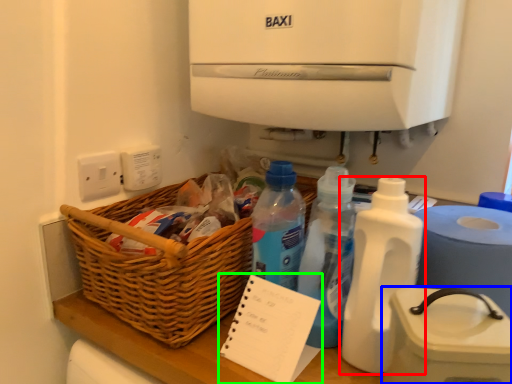
Question: Estimate the real-world distances between objects in this image. Which object is closer to bottle (highlighted by a red box), appliance (highlighted by a blue box) or notepad (highlighted by a green box)?

Choices:
 (A) appliance
 (B) notepad

Answer: (A)